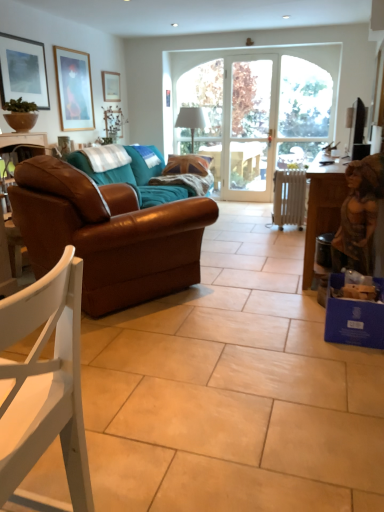
Question: From a real-world perspective, is wooden picture frame at upper left, acting as the 2th picture frame starting from the right, beneath wooden table at right?

Choices:
 (A) no
 (B) yes

Answer: (A)

Question: Does wooden picture frame at upper left, acting as the 2th picture frame starting from the right, have a smaller size compared to wooden table at right?

Choices:
 (A) no
 (B) yes

Answer: (B)

Question: Can you see wooden picture frame at upper left, placed as the second picture frame when sorted from front to back, touching wooden table at right?

Choices:
 (A) yes
 (B) no

Answer: (B)

Question: Can you confirm if wooden picture frame at upper left, which ranks as the 2th picture frame in back-to-front order, is bigger than wooden table at right?

Choices:
 (A) yes
 (B) no

Answer: (B)

Question: Considering the relative sizes of wooden picture frame at upper left, which ranks as the 2th picture frame in back-to-front order, and wooden table at right in the image provided, is wooden picture frame at upper left, which ranks as the 2th picture frame in back-to-front order, thinner than wooden table at right?

Choices:
 (A) no
 (B) yes

Answer: (B)

Question: Visually, is wooden picture frame at upper left, which ranks as the 2th picture frame in back-to-front order, positioned to the left or to the right of wooden table at right?

Choices:
 (A) right
 (B) left

Answer: (B)

Question: From their relative heights in the image, would you say wooden picture frame at upper left, which ranks as the 2th picture frame in back-to-front order, is taller or shorter than wooden table at right?

Choices:
 (A) tall
 (B) short

Answer: (A)

Question: Is wooden picture frame at upper left, placed as the second picture frame when sorted from front to back, in front of or behind wooden table at right in the image?

Choices:
 (A) behind
 (B) front

Answer: (A)

Question: From the image's perspective, is wooden picture frame at upper left, acting as the 2th picture frame starting from the right, located above or below wooden table at right?

Choices:
 (A) above
 (B) below

Answer: (A)

Question: Is matte white picture frame at upper center, positioned as the 3th picture frame in front-to-back order, bigger or smaller than matte black picture frame at upper left, placed as the third picture frame when sorted from right to left?

Choices:
 (A) big
 (B) small

Answer: (B)

Question: In the image, is matte white picture frame at upper center, positioned as the first picture frame in back-to-front order, positioned in front of or behind matte black picture frame at upper left, marked as the 1th picture frame in a front-to-back arrangement?

Choices:
 (A) front
 (B) behind

Answer: (B)

Question: Would you say matte white picture frame at upper center, positioned as the first picture frame in back-to-front order, is inside or outside matte black picture frame at upper left, marked as the 1th picture frame in a front-to-back arrangement?

Choices:
 (A) inside
 (B) outside

Answer: (B)

Question: Based on their positions, is matte white picture frame at upper center, which is the third picture frame in left-to-right order, located to the left or right of matte black picture frame at upper left, placed as the third picture frame when sorted from right to left?

Choices:
 (A) right
 (B) left

Answer: (A)

Question: In terms of height, does brown leather couch at left look taller or shorter compared to matte brown bowl at upper left?

Choices:
 (A) short
 (B) tall

Answer: (B)

Question: Is brown leather couch at left wider or thinner than matte brown bowl at upper left?

Choices:
 (A) wide
 (B) thin

Answer: (A)